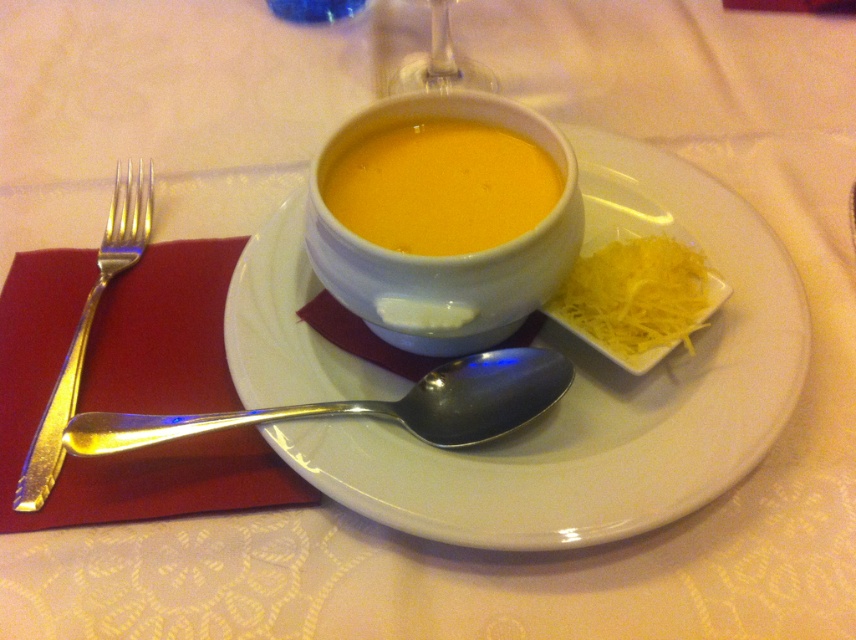
You are a chef preparing a dish and need to compare the portions of the yellow shredded cheese at right and the transparent glass at upper center. Which one takes up more space on the table?

The transparent glass at upper center occupies more space than the yellow shredded cheese at right.

You are a guest at a dinner table and see the yellow shredded cheese at right and the transparent glass at upper center. Which item is closer to you?

The yellow shredded cheese at right is closer to you because it is in front of the transparent glass at upper center.

You are a food delivery person who needs to place a hot pad under the yellow matte soup at center to prevent the table from getting too hot. The hot pad you have is 16 inches long. Can you safely place it under the soup without it extending beyond the table edge?

The yellow matte soup at center is 15.27 inches away from viewer. Since the hot pad is 16 inches long, it will extend beyond the table edge by approximately 0.73 inches. Therefore, it is not safe to place the hot pad under the soup without it hanging over the edge.